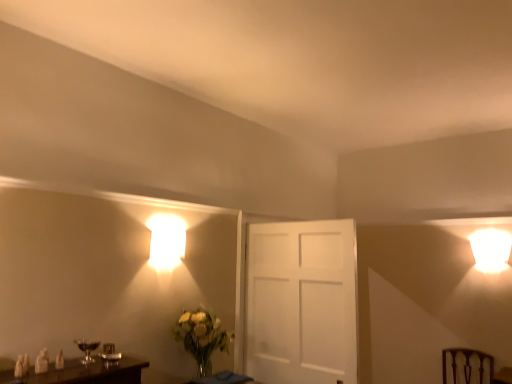
Question: Is brown wooden swivel chair at lower right closer to the viewer compared to translucent glass table at lower center?

Choices:
 (A) yes
 (B) no

Answer: (B)

Question: Is brown wooden swivel chair at lower right oriented away from translucent glass table at lower center?

Choices:
 (A) yes
 (B) no

Answer: (B)

Question: Does brown wooden swivel chair at lower right touch translucent glass table at lower center?

Choices:
 (A) no
 (B) yes

Answer: (A)

Question: Is the position of brown wooden swivel chair at lower right more distant than that of translucent glass table at lower center?

Choices:
 (A) no
 (B) yes

Answer: (B)

Question: From a real-world perspective, is brown wooden swivel chair at lower right below translucent glass table at lower center?

Choices:
 (A) no
 (B) yes

Answer: (B)

Question: Can you confirm if brown wooden swivel chair at lower right is taller than translucent glass table at lower center?

Choices:
 (A) no
 (B) yes

Answer: (B)

Question: Does matte glass wine glass at lower left have a larger size compared to brown wooden swivel chair at lower right?

Choices:
 (A) yes
 (B) no

Answer: (B)

Question: Can we say matte glass wine glass at lower left lies outside brown wooden swivel chair at lower right?

Choices:
 (A) yes
 (B) no

Answer: (A)

Question: Is the depth of matte glass wine glass at lower left greater than that of brown wooden swivel chair at lower right?

Choices:
 (A) no
 (B) yes

Answer: (A)

Question: Is matte glass wine glass at lower left facing away from brown wooden swivel chair at lower right?

Choices:
 (A) yes
 (B) no

Answer: (B)

Question: Does matte glass wine glass at lower left touch brown wooden swivel chair at lower right?

Choices:
 (A) no
 (B) yes

Answer: (A)

Question: Considering the relative positions of matte glass wine glass at lower left and brown wooden swivel chair at lower right in the image provided, is matte glass wine glass at lower left to the right of brown wooden swivel chair at lower right from the viewer's perspective?

Choices:
 (A) no
 (B) yes

Answer: (A)

Question: Is matte glass wine glass at lower left smaller than translucent glass table at lower center?

Choices:
 (A) no
 (B) yes

Answer: (B)